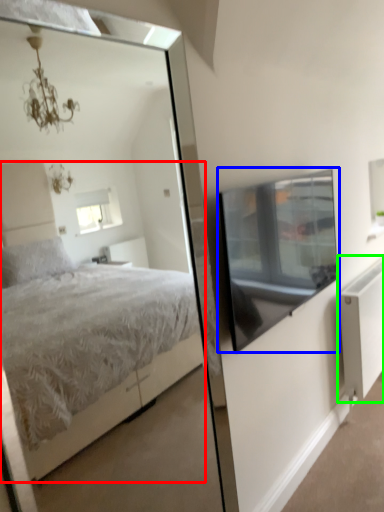
Question: Based on their relative distances, which object is nearer to bed (highlighted by a red box)? Choose from window screen (highlighted by a blue box) and radiator (highlighted by a green box).

Choices:
 (A) window screen
 (B) radiator

Answer: (B)